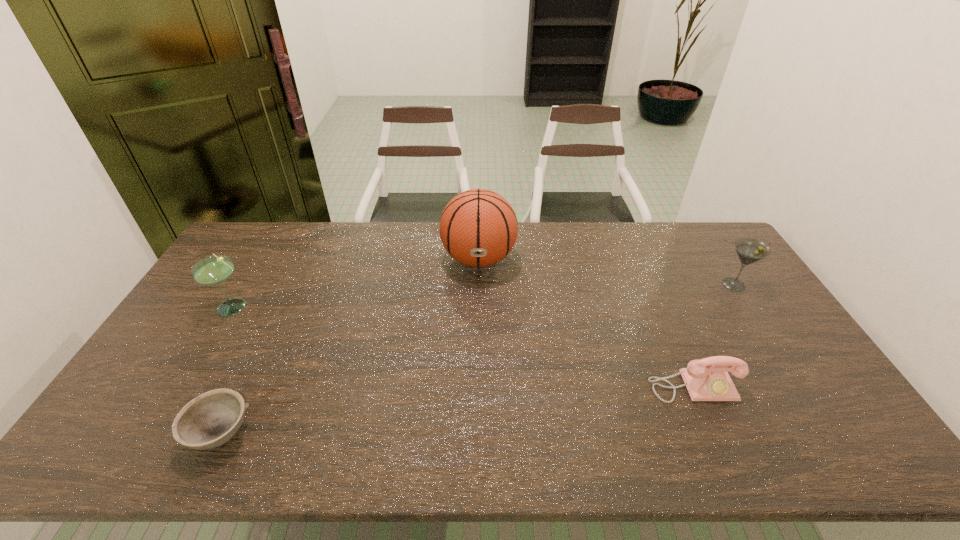
This screenshot has height=540, width=960. What are the coordinates of `free space between the bowl and the right martini` in the screenshot? It's located at (477, 359).

Where is `vacant area that lies between the tallest object and the second object from right to left`? vacant area that lies between the tallest object and the second object from right to left is located at coordinates (586, 323).

Identify the location of free space that is in between the left martini and the tallest object. (357, 283).

Identify which object is the closest to the fourth object from left to right. Please provide its 2D coordinates. Your answer should be formatted as a tuple, i.e. [(x, y)], where the tuple contains the x and y coordinates of a point satisfying the conditions above.

[(749, 250)]

Select which object appears as the second closest to the rightmost object. Please provide its 2D coordinates. Your answer should be formatted as a tuple, i.e. [(x, y)], where the tuple contains the x and y coordinates of a point satisfying the conditions above.

[(478, 228)]

Locate an element on the screen. The image size is (960, 540). vacant area that satisfies the following two spatial constraints: 1. on the back side of the rightmost object; 2. on the left side of the shortest object is located at coordinates (292, 285).

I want to click on free space that satisfies the following two spatial constraints: 1. on the front side of the left martini; 2. on the left side of the bowl, so click(x=160, y=433).